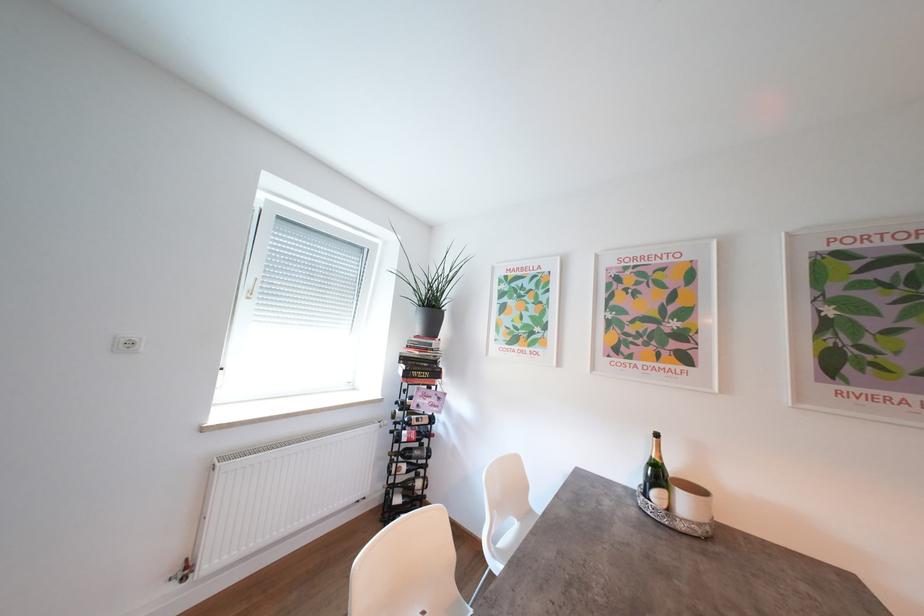
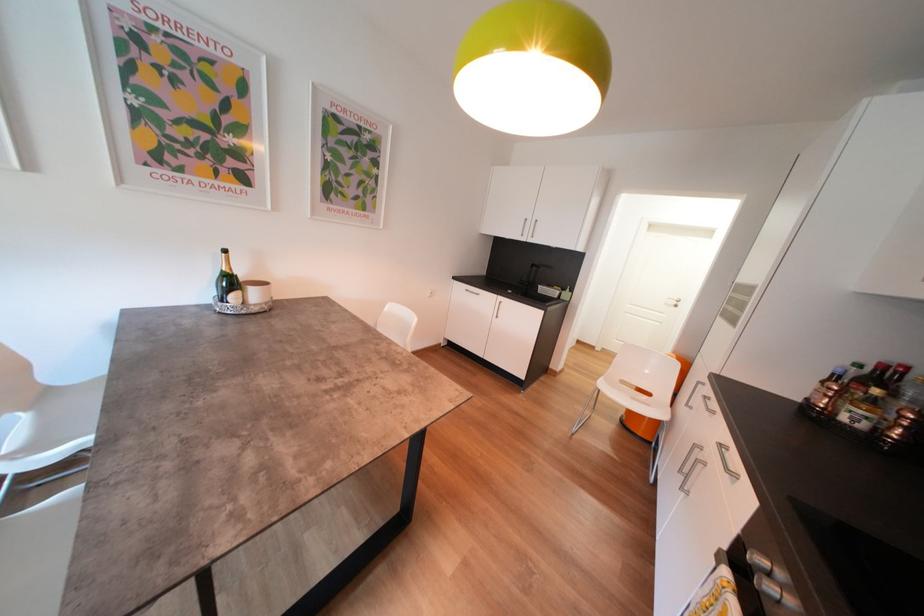
The first image is from the beginning of the video and the second image is from the end. How did the camera likely rotate when shooting the video?

The camera's rotation is toward right-down.